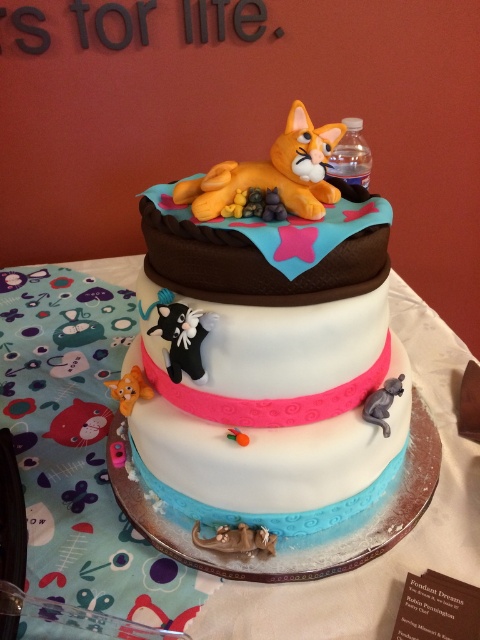
Can you confirm if matte white cake at center is wider than black plush cat at center?

Yes, matte white cake at center is wider than black plush cat at center.

What do you see at coordinates (271, 346) in the screenshot? I see `matte white cake at center` at bounding box center [271, 346].

Is point (268, 316) closer to viewer compared to point (191, 344)?

Yes, point (268, 316) is closer to viewer.

At what (x,y) coordinates should I click in order to perform the action: click on matte white cake at center. Please return your answer as a coordinate pair (x, y). The width and height of the screenshot is (480, 640). Looking at the image, I should click on (271, 346).

Can you confirm if matte white cake at center is positioned below orange fondant cat at upper center?

Yes.

Which is behind, point (225, 289) or point (314, 148)?

Point (314, 148)

Locate an element on the screen. matte white cake at center is located at coordinates (271, 346).

This screenshot has height=640, width=480. I want to click on black plush cat at center, so pos(182,339).

Does point (180, 337) come farther from viewer compared to point (112, 392)?

That is False.

Where is `black plush cat at center`? The width and height of the screenshot is (480, 640). black plush cat at center is located at coordinates (182, 339).